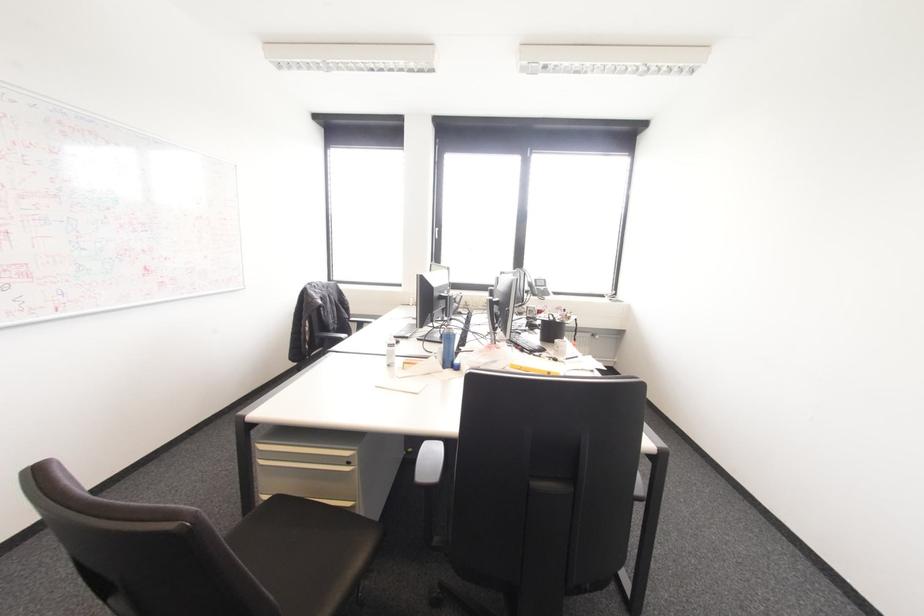
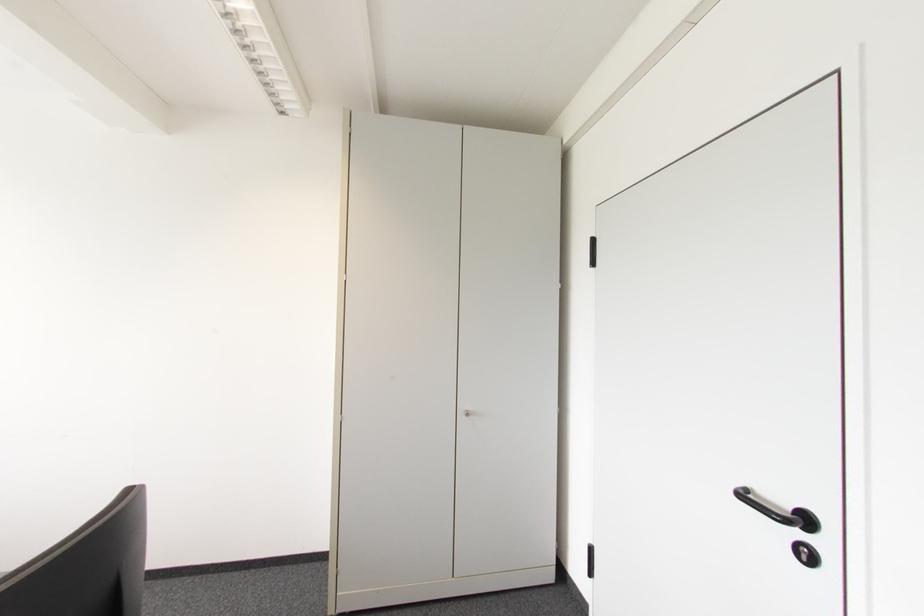
Question: Based on the continuous images, in which direction is the camera rotating? Reply with the corresponding letter.

Choices:
 (A) Left
 (B) Right
 (C) Up
 (D) Down

Answer: (B)